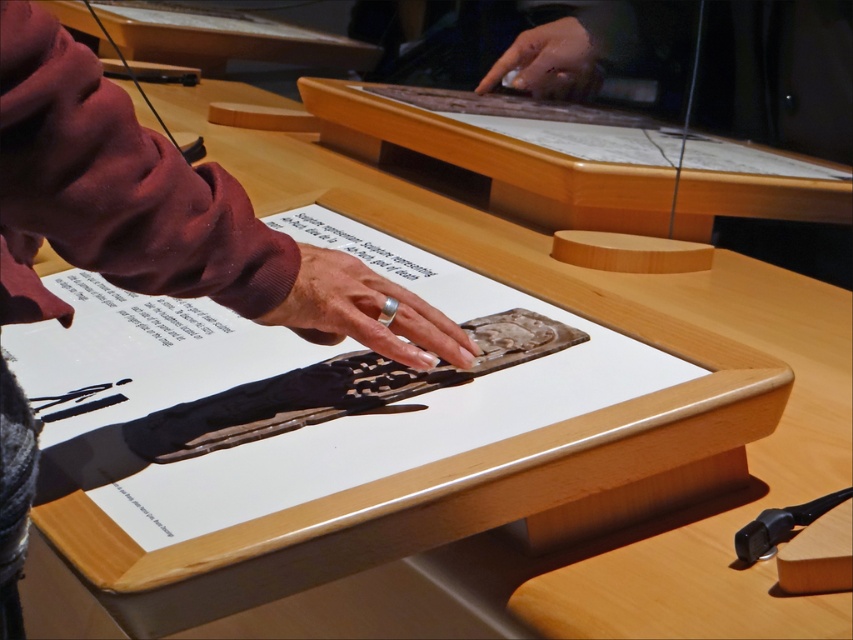
Question: Can you confirm if wooden table at upper center is positioned to the left of silver metallic ring at center?

Choices:
 (A) yes
 (B) no

Answer: (A)

Question: Which of the following is the closest to the observer?

Choices:
 (A) (380, 51)
 (B) (463, 355)
 (C) (410, 333)

Answer: (C)

Question: Which object is positioned closest to the silver metallic ring at center?

Choices:
 (A) smooth skin hand at upper center
 (B) wooden table at upper center
 (C) matte black hand at center
 (D) wooden table at center

Answer: (C)

Question: Which object is closer to the camera taking this photo?

Choices:
 (A) wooden table at center
 (B) matte black hand at center
 (C) smooth skin hand at upper center

Answer: (B)

Question: Is wooden table at center to the right of silver metallic ring at center from the viewer's perspective?

Choices:
 (A) no
 (B) yes

Answer: (B)

Question: Where is matte black hand at center located in relation to silver metallic ring at center in the image?

Choices:
 (A) below
 (B) above

Answer: (A)